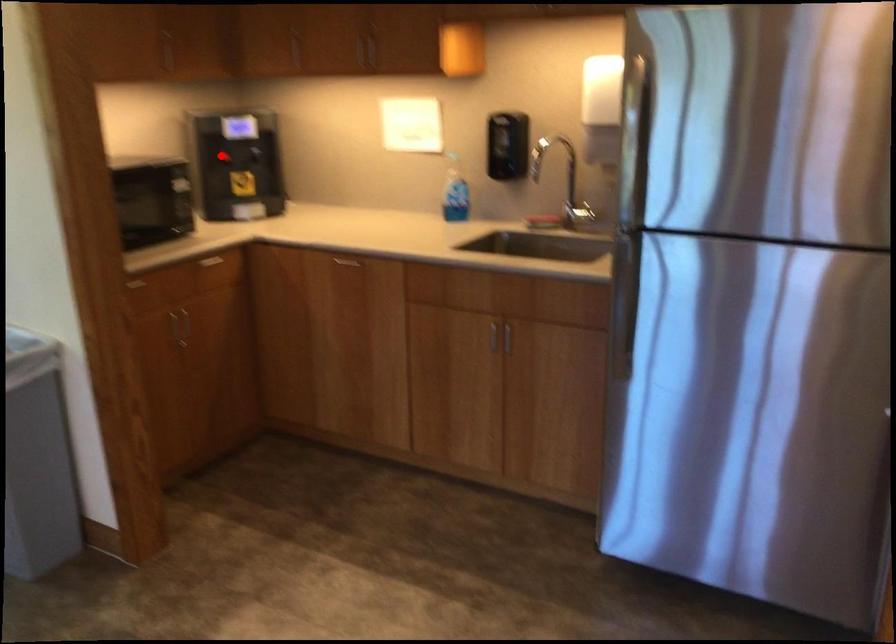
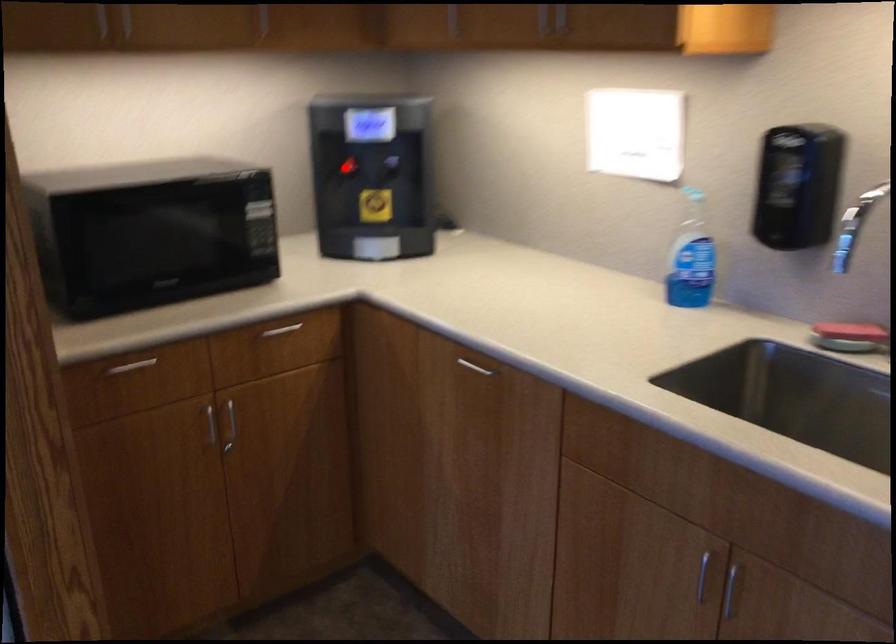
I am providing you with two images of the same scene from different viewpoints. A red point is marked on the first image and another point is marked on the second image. Does the point marked in image1 correspond to the same location as the one in image2?

Yes